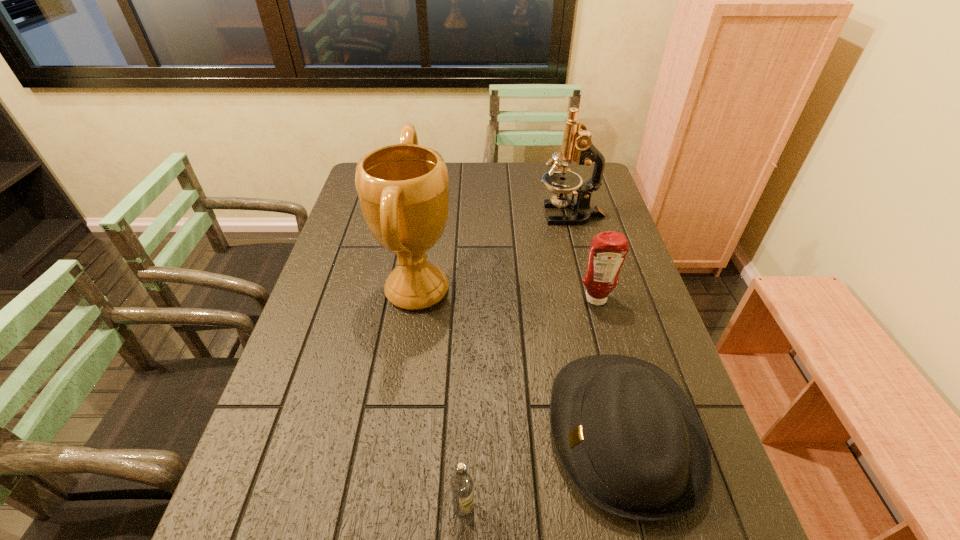
I want to click on award, so click(x=403, y=191).

Identify the location of the farthest object. The image size is (960, 540). (577, 146).

The image size is (960, 540). In order to click on condiment in this screenshot , I will do `click(608, 250)`.

This screenshot has height=540, width=960. I want to click on the fourth object from right to left, so click(462, 483).

You are a GUI agent. You are given a task and a screenshot of the screen. Output one action in this format:
    pyautogui.click(x=<x>, y=<y>)
    Task: Click on the fedora
    The height and width of the screenshot is (540, 960).
    Given the screenshot: What is the action you would take?
    click(x=628, y=437)

I want to click on vacant area situated 0.400m on the front of the leftmost object with the decoration, so click(597, 290).

I want to click on free location located at the eyepiece of the farthest object, so click(468, 214).

Locate an element on the screen. Image resolution: width=960 pixels, height=540 pixels. vacant space positioned at the eyepiece of the farthest object is located at coordinates (432, 214).

Image resolution: width=960 pixels, height=540 pixels. Find the location of `free space located 0.240m at the eyepiece of the farthest object`. free space located 0.240m at the eyepiece of the farthest object is located at coordinates (468, 214).

Identify the location of vacant space located 0.190m on the left of the condiment. (510, 299).